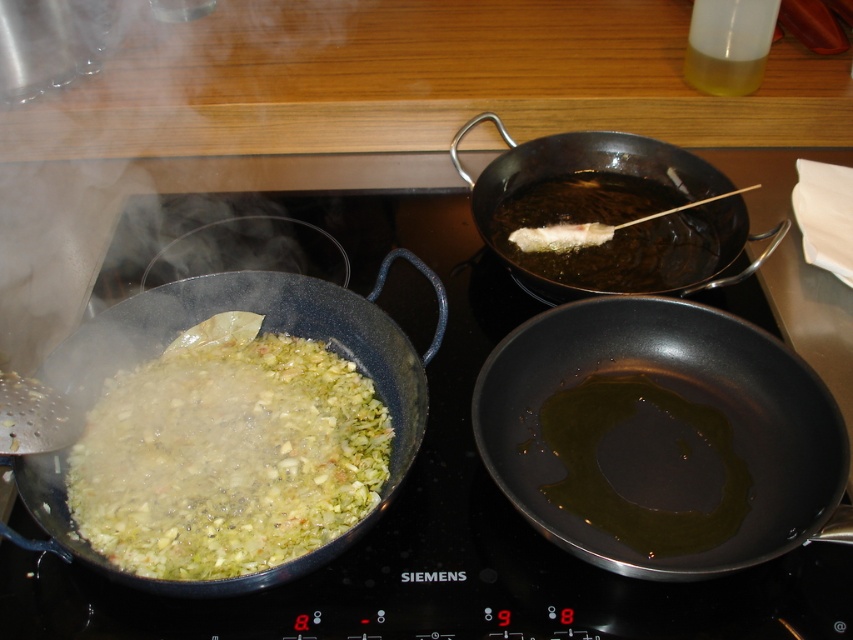
Which is below, shiny black pan at lower right or shiny black wok at upper right?

shiny black pan at lower right is lower down.

Is shiny black pan at lower right to the left of shiny black wok at upper right from the viewer's perspective?

In fact, shiny black pan at lower right is to the right of shiny black wok at upper right.

Which is in front, point (740, 355) or point (465, 173)?

Point (740, 355)

I want to click on shiny black pan at lower right, so click(660, 436).

Who is positioned more to the left, shiny black wok at lower left or shiny black wok at upper right?

Positioned to the left is shiny black wok at lower left.

Measure the distance between shiny black wok at lower left and shiny black wok at upper right.

shiny black wok at lower left is 28.86 centimeters from shiny black wok at upper right.

Where is `shiny black wok at lower left`? shiny black wok at lower left is located at coordinates (263, 330).

Can you confirm if shiny black pan at lower right is shorter than shiny black wok at lower left?

Correct, shiny black pan at lower right is not as tall as shiny black wok at lower left.

Locate an element on the screen. This screenshot has width=853, height=640. shiny black pan at lower right is located at coordinates (660, 436).